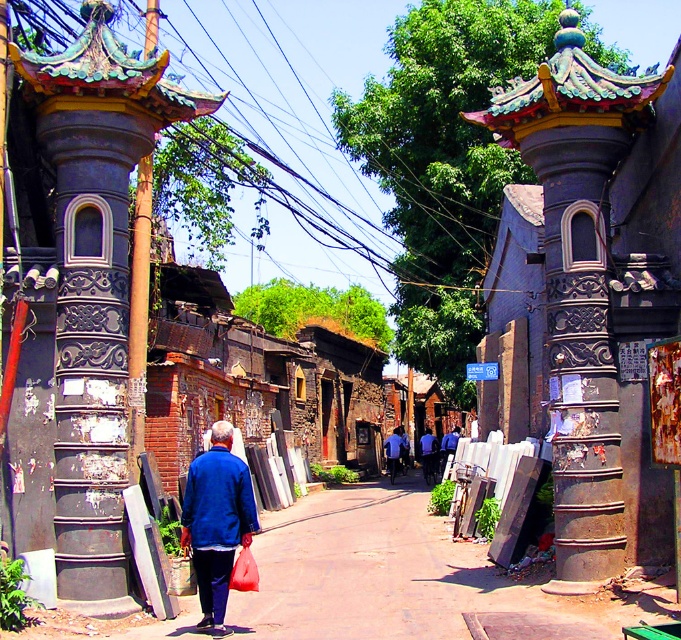
Which is below, brushed metal power line at upper center or blue matte jacket at lower left?

blue matte jacket at lower left

Which is behind, point (170, 17) or point (191, 486)?

Positioned behind is point (170, 17).

This screenshot has width=681, height=640. What are the coordinates of `brushed metal power line at upper center` in the screenshot? It's located at (287, 76).

The height and width of the screenshot is (640, 681). What do you see at coordinates (217, 522) in the screenshot? I see `blue matte jacket at center` at bounding box center [217, 522].

Does blue matte jacket at center have a lesser height compared to blue fabric jacket at center?

Incorrect, blue matte jacket at center's height does not fall short of blue fabric jacket at center's.

Is point (223, 563) in front of point (430, 477)?

That is True.

Locate an element on the screen. This screenshot has width=681, height=640. blue matte jacket at center is located at coordinates (217, 522).

Does point (219, 458) come farther from viewer compared to point (428, 458)?

No, it is not.

Can you confirm if blue matte jacket at lower left is wider than blue fabric jacket at center?

Incorrect, blue matte jacket at lower left's width does not surpass blue fabric jacket at center's.

Is point (204, 467) positioned before point (424, 472)?

Yes, point (204, 467) is closer to viewer.

Where is `blue matte jacket at lower left`? The image size is (681, 640). blue matte jacket at lower left is located at coordinates (219, 500).